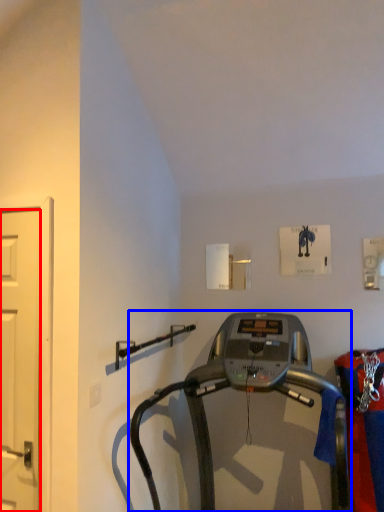
Question: Which point is further to the camera, door (highlighted by a red box) or treadmill (highlighted by a blue box)?

Choices:
 (A) door
 (B) treadmill

Answer: (A)